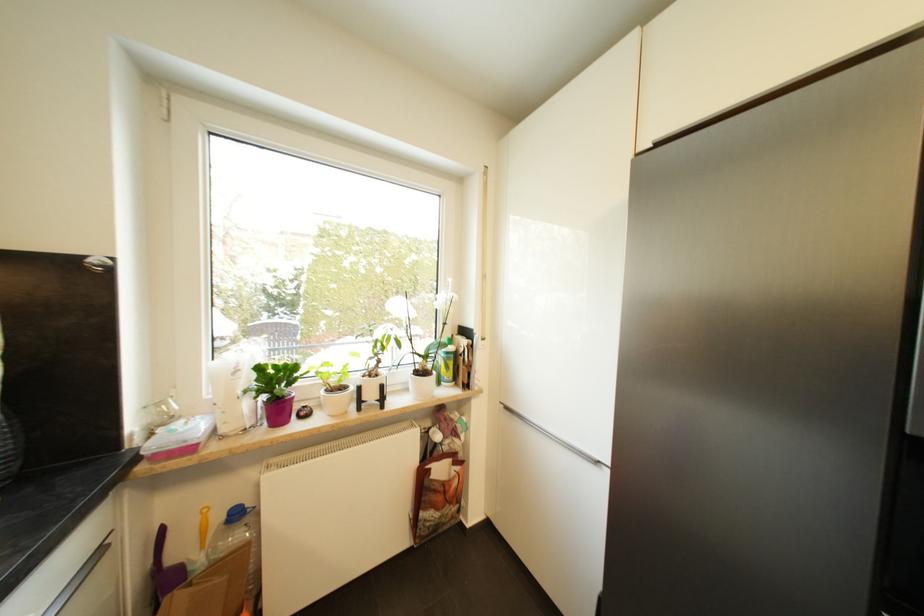
This screenshot has height=616, width=924. I want to click on silver drawer handle, so click(98, 586).